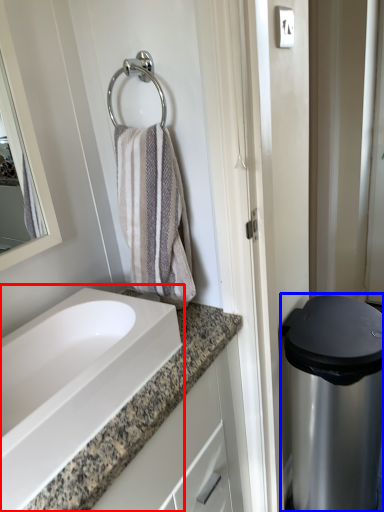
Question: Which object is closer to the camera taking this photo, sink (highlighted by a red box) or appliance (highlighted by a blue box)?

Choices:
 (A) sink
 (B) appliance

Answer: (A)